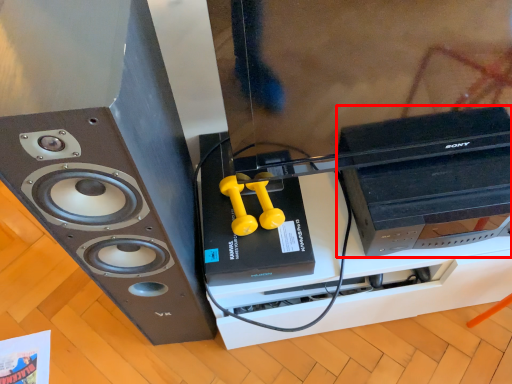
Question: From the image's perspective, where is computer (annotated by the red box) located in relation to home appliance in the image?

Choices:
 (A) above
 (B) below

Answer: (A)